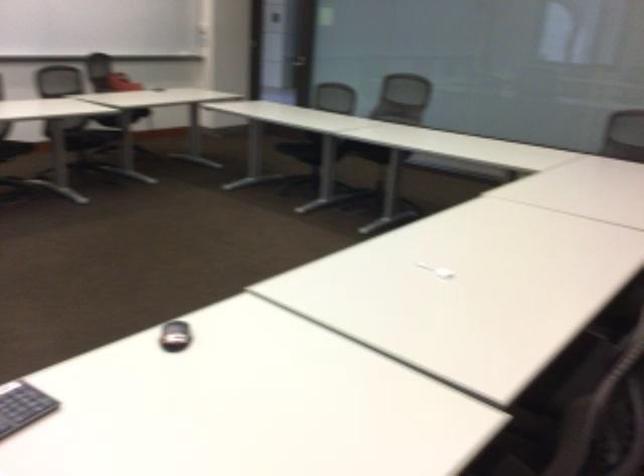
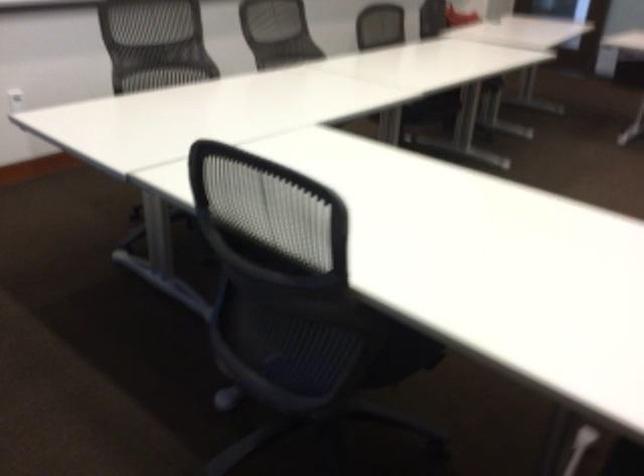
First-person continuous shooting, in which direction is the camera rotating?

The camera rotated toward right-down.